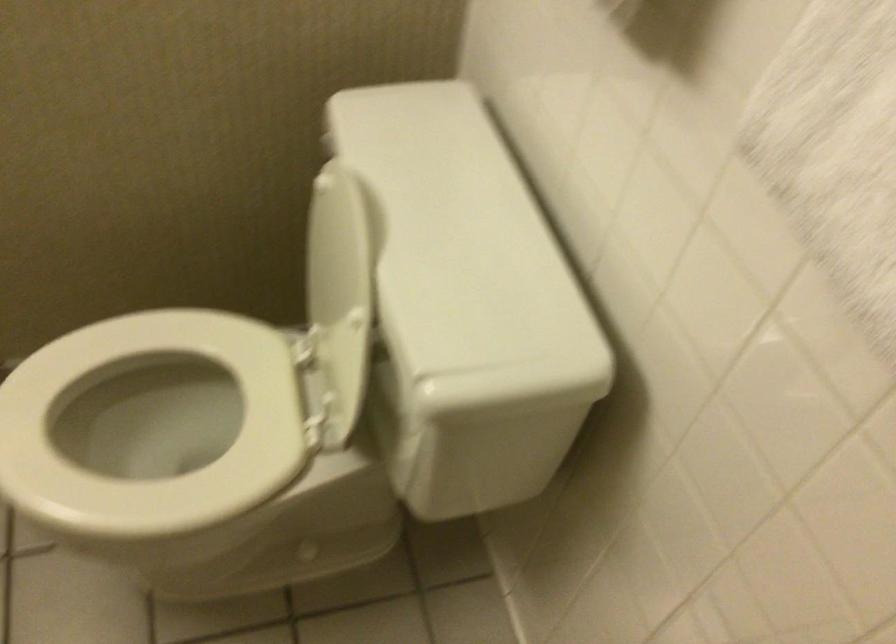
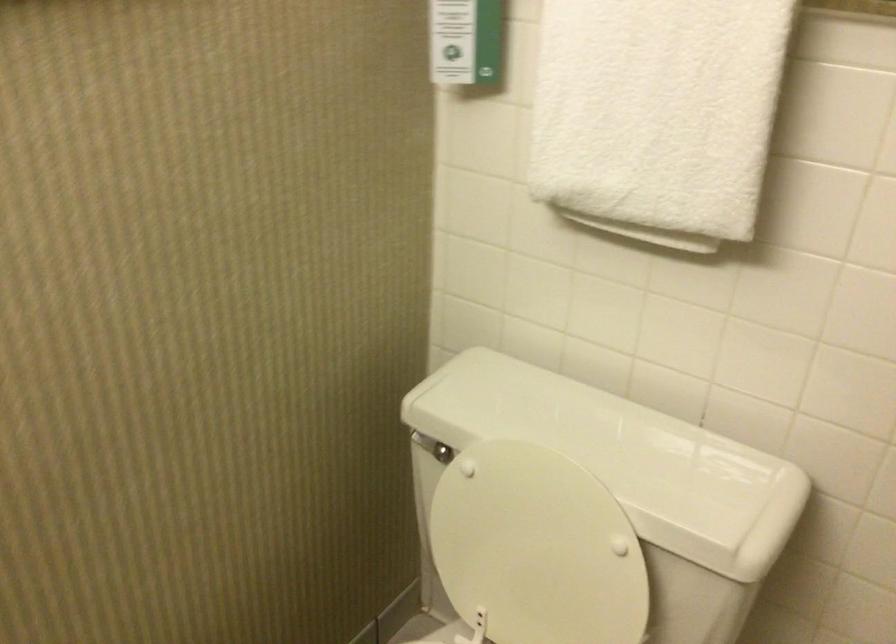
Question: I am providing you with two images of the same scene from different viewpoints. After the viewpoint changes to image2, which objects are now occluded?

Choices:
 (A) toilet flush handle
 (B) white toilet lid
 (C) wall-mounted dispenser
 (D) none of these

Answer: (D)